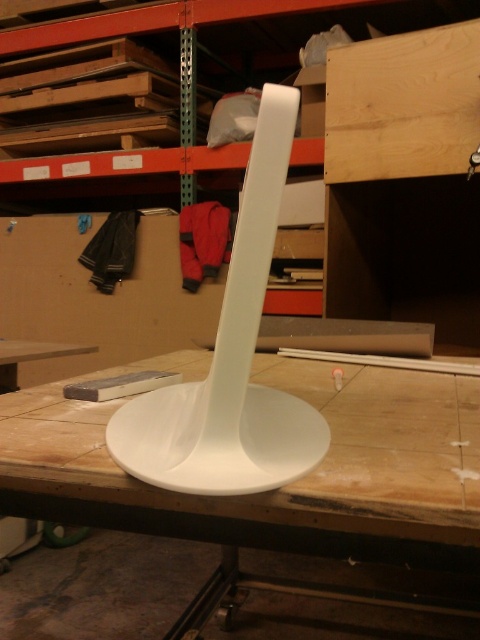
Question: Does white matte table at center appear on the left side of light brown wood at upper right?

Choices:
 (A) yes
 (B) no

Answer: (A)

Question: Does white matte table at center have a lesser width compared to light brown wood at upper right?

Choices:
 (A) no
 (B) yes

Answer: (A)

Question: Does white matte table at center have a larger size compared to light brown wood at upper right?

Choices:
 (A) no
 (B) yes

Answer: (B)

Question: Which point is closer to the camera?

Choices:
 (A) (0, 486)
 (B) (393, 144)

Answer: (A)